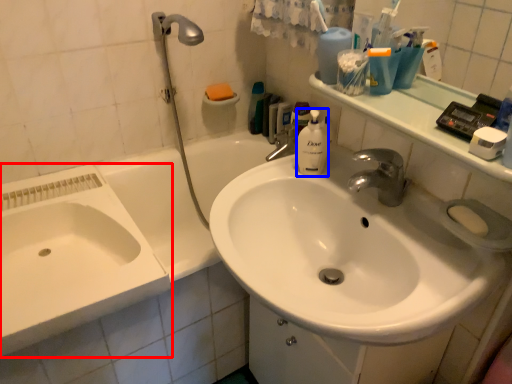
Question: Which point is further to the camera, sink (highlighted by a red box) or cleaning product (highlighted by a blue box)?

Choices:
 (A) sink
 (B) cleaning product

Answer: (B)